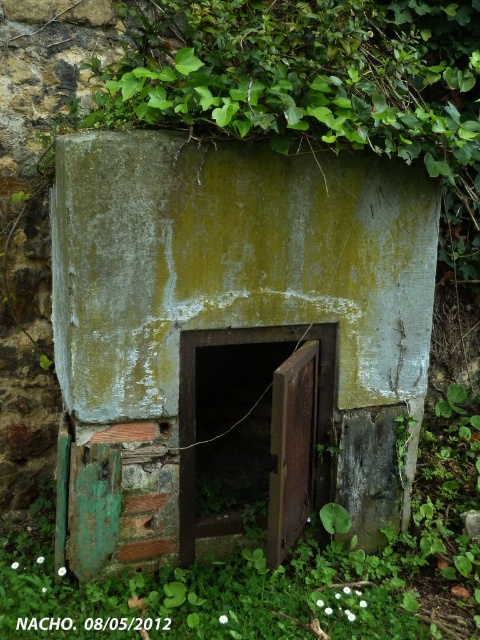
Looking at this image, you are standing in front of a weathered concrete structure. You see a green weathered concrete door at center and green mossy leaves at center. Which object is positioned to the left of the other?

The green weathered concrete door at center is to the left of green mossy leaves at center.

Looking at this image, you are a maintenance worker needing to access the green weathered concrete door at center. There are green mossy leaves at center blocking your path. Can you walk through the space between them without bending down?

The green weathered concrete door at center and green mossy leaves at center are 21.05 inches apart. Since the distance is narrow, you would need to bend down to pass through the space between them.

You are a painter trying to paint the green weathered concrete door at center and the green mossy leaves at center. Which object should you paint first if you want to paint the taller one first?

The green weathered concrete door at center has a greater height compared to green mossy leaves at center, so you should paint the green weathered concrete door at center first.